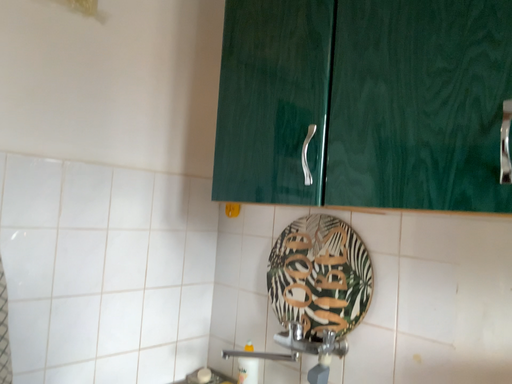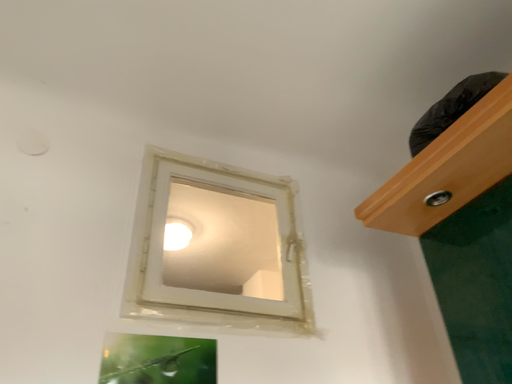
Question: Which way did the camera rotate in the video?

Choices:
 (A) rotated downward
 (B) rotated upward

Answer: (B)